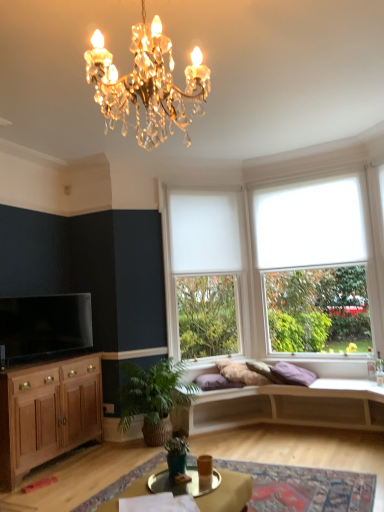
Locate an element on the screen. green leafy plant at lower center, positioned as the second houseplant in front-to-back order is located at coordinates (154, 398).

Locate an element on the screen. metallic silver cocktail table at center is located at coordinates (182, 484).

What is the approximate width of metallic silver cocktail table at center?

18.46 inches.

The height and width of the screenshot is (512, 384). I want to click on white roller blind at center, which appears as the first window when viewed from the left, so click(x=205, y=250).

Looking at this image, measure the distance between black glossy television at left and camera.

The distance of black glossy television at left from camera is 3.74 meters.

What is the approximate height of white roller blind at right, the 2th window when ordered from left to right?

white roller blind at right, the 2th window when ordered from left to right, is 2.23 meters in height.

What is the approximate height of white matte blind at upper center?

white matte blind at upper center is 3.46 feet in height.

What are the coordinates of `green leafy plant at lower center, the first houseplant when ordered from back to front` in the screenshot? It's located at (x=154, y=398).

Which of these two, white roller blind at center, the 2th window in the right-to-left sequence, or white matte studio couch at center, stands shorter?

white matte studio couch at center.

From the image's perspective, is white roller blind at center, the 2th window in the right-to-left sequence, below white matte studio couch at center?

No.

Considering the positions of objects white roller blind at center, which appears as the first window when viewed from the left, and white matte studio couch at center in the image provided, who is behind, white roller blind at center, which appears as the first window when viewed from the left, or white matte studio couch at center?

white roller blind at center, which appears as the first window when viewed from the left, is more distant.

Is white roller blind at center, the 2th window in the right-to-left sequence, facing towards white matte studio couch at center?

No, white roller blind at center, the 2th window in the right-to-left sequence, does not turn towards white matte studio couch at center.

Considering the positions of objects green leafy plant at lower center, positioned as the second houseplant in front-to-back order, and white roller blind at right, which appears as the 1th window when viewed from the right, in the image provided, who is in front, green leafy plant at lower center, positioned as the second houseplant in front-to-back order, or white roller blind at right, which appears as the 1th window when viewed from the right,?

green leafy plant at lower center, positioned as the second houseplant in front-to-back order, is more forward.

Is green leafy plant at lower center, positioned as the second houseplant in front-to-back order, at the right side of white roller blind at right, which appears as the 1th window when viewed from the right?

No, green leafy plant at lower center, positioned as the second houseplant in front-to-back order, is not to the right of white roller blind at right, which appears as the 1th window when viewed from the right.

I want to click on window that is the 2nd object to the right of the green leafy plant at lower center, positioned as the second houseplant in front-to-back order, starting at the anchor, so click(286, 267).

Measure the distance between green leafy plant at lower center, positioned as the second houseplant in front-to-back order, and white roller blind at right, which appears as the 1th window when viewed from the right.

A distance of 4.11 feet exists between green leafy plant at lower center, positioned as the second houseplant in front-to-back order, and white roller blind at right, which appears as the 1th window when viewed from the right.

From the image's perspective, is white roller blind at right beneath green matte plant at lower center, marked as the first houseplant in a front-to-back arrangement?

Actually, white roller blind at right appears above green matte plant at lower center, marked as the first houseplant in a front-to-back arrangement, in the image.

How far apart are white roller blind at right and green matte plant at lower center, marked as the first houseplant in a front-to-back arrangement?

white roller blind at right and green matte plant at lower center, marked as the first houseplant in a front-to-back arrangement, are 9.85 feet apart from each other.

Which of these two, white roller blind at right or green matte plant at lower center, acting as the second houseplant starting from the back, is smaller?

green matte plant at lower center, acting as the second houseplant starting from the back.

Is white roller blind at right aimed at green matte plant at lower center, marked as the first houseplant in a front-to-back arrangement?

No, white roller blind at right is not turned towards green matte plant at lower center, marked as the first houseplant in a front-to-back arrangement.

Is metallic gold tray at lower center smaller than white roller blind at center, the 2th window in the right-to-left sequence?

Yes, metallic gold tray at lower center is smaller than white roller blind at center, the 2th window in the right-to-left sequence.

What's the angular difference between metallic gold tray at lower center and white roller blind at center, the 2th window in the right-to-left sequence,'s facing directions?

43.5 degrees separate the facing orientations of metallic gold tray at lower center and white roller blind at center, the 2th window in the right-to-left sequence.

From the picture: From a real-world perspective, is metallic gold tray at lower center physically located above or below white roller blind at center, the 2th window in the right-to-left sequence?

metallic gold tray at lower center is situated lower than white roller blind at center, the 2th window in the right-to-left sequence, in the real world.

Considering the positions of objects metallic gold tray at lower center and white roller blind at center, which appears as the first window when viewed from the left, in the image provided, who is more to the right, metallic gold tray at lower center or white roller blind at center, which appears as the first window when viewed from the left,?

Positioned to the right is white roller blind at center, which appears as the first window when viewed from the left.

Looking at this image, from the image's perspective, is white roller blind at right, which appears as the 1th window when viewed from the right, above or below metallic gold tray at lower center?

white roller blind at right, which appears as the 1th window when viewed from the right, is above metallic gold tray at lower center.

From the picture: Considering the relative sizes of white roller blind at right, which appears as the 1th window when viewed from the right, and metallic gold tray at lower center in the image provided, is white roller blind at right, which appears as the 1th window when viewed from the right, wider than metallic gold tray at lower center?

No.

Considering the relative sizes of white roller blind at right, the 2th window when ordered from left to right, and metallic gold tray at lower center in the image provided, is white roller blind at right, the 2th window when ordered from left to right, smaller than metallic gold tray at lower center?

Incorrect, white roller blind at right, the 2th window when ordered from left to right, is not smaller in size than metallic gold tray at lower center.

Considering the relative positions of white roller blind at right, which appears as the 1th window when viewed from the right, and metallic gold tray at lower center in the image provided, is white roller blind at right, which appears as the 1th window when viewed from the right, to the left of metallic gold tray at lower center from the viewer's perspective?

In fact, white roller blind at right, which appears as the 1th window when viewed from the right, is to the right of metallic gold tray at lower center.

Is metallic gold tray at lower center spatially inside wooden cabinet at lower left, or outside of it?

Answer: metallic gold tray at lower center is outside wooden cabinet at lower left.

Looking at their sizes, would you say metallic gold tray at lower center is wider or thinner than wooden cabinet at lower left?

In the image, metallic gold tray at lower center appears to be wider than wooden cabinet at lower left.

From the image's perspective, which object appears higher, metallic gold tray at lower center or wooden cabinet at lower left?

From the image's view, wooden cabinet at lower left is above.

Considering the sizes of objects metallic gold tray at lower center and wooden cabinet at lower left in the image provided, who is bigger, metallic gold tray at lower center or wooden cabinet at lower left?

wooden cabinet at lower left is bigger.

Is purple cotton pillow at center wider than white roller blind at center, which appears as the first window when viewed from the left?

Indeed, purple cotton pillow at center has a greater width compared to white roller blind at center, which appears as the first window when viewed from the left.

From the image's perspective, who appears lower, purple cotton pillow at center or white roller blind at center, the 2th window in the right-to-left sequence?

From the image's view, purple cotton pillow at center is below.

Is point (237, 371) closer to camera compared to point (166, 222)?

That is True.

Considering the relative positions of purple cotton pillow at center and white roller blind at center, the 2th window in the right-to-left sequence, in the image provided, is purple cotton pillow at center to the left of white roller blind at center, the 2th window in the right-to-left sequence, from the viewer's perspective?

No, purple cotton pillow at center is not to the left of white roller blind at center, the 2th window in the right-to-left sequence.

The height and width of the screenshot is (512, 384). I want to click on studio couch in front of the white roller blind at center, the 2th window in the right-to-left sequence, so click(x=287, y=406).

From a real-world perspective, starting from the white roller blind at right, the 2th window when ordered from left to right, which houseplant is the 2nd one below it? Please provide its 2D coordinates.

[(154, 398)]

Looking at the image, which one is located further to white roller blind at right, black glossy television at left or white matte blind at upper center?

Based on the image, black glossy television at left appears to be further to white roller blind at right.

Considering their positions, is white roller blind at right positioned further to green leafy plant at lower center, the first houseplant when ordered from back to front, than white roller blind at center, the 2th window in the right-to-left sequence?

white roller blind at right is positioned further to the anchor green leafy plant at lower center, the first houseplant when ordered from back to front.

Estimate the real-world distances between objects in this image. Which object is closer to purple cotton pillow at center, white matte blind at upper center or wooden cabinet at lower left?

white matte blind at upper center is positioned closer to the anchor purple cotton pillow at center.

Which object lies further to the anchor point white roller blind at right, which appears as the 1th window when viewed from the right, metallic silver cocktail table at center or black glossy television at left?

metallic silver cocktail table at center lies further to white roller blind at right, which appears as the 1th window when viewed from the right, than the other object.

Based on their spatial positions, is green leafy plant at lower center, positioned as the second houseplant in front-to-back order, or metallic gold tray at lower center further from black glossy television at left?

Based on the image, metallic gold tray at lower center appears to be further to black glossy television at left.

Based on their spatial positions, is white matte blind at upper center or green leafy plant at lower center, the first houseplant when ordered from back to front, closer to white roller blind at right?

white matte blind at upper center lies closer to white roller blind at right than the other object.

When comparing their distances from white roller blind at center, which appears as the first window when viewed from the left, does metallic gold tray at lower center or wooden cabinet at lower left seem closer?

The object closer to white roller blind at center, which appears as the first window when viewed from the left, is wooden cabinet at lower left.

Estimate the real-world distances between objects in this image. Which object is further from green leafy plant at lower center, the first houseplant when ordered from back to front, wooden cabinet at lower left or white matte studio couch at center?

Based on the image, wooden cabinet at lower left appears to be further to green leafy plant at lower center, the first houseplant when ordered from back to front.

You are a GUI agent. You are given a task and a screenshot of the screen. Output one action in this format:
    pyautogui.click(x=<x>, y=<y>)
    Task: Click on the houseplant between metallic gold tray at lower center and white matte studio couch at center from front to back
    
    Given the screenshot: What is the action you would take?
    pyautogui.click(x=177, y=455)

Image resolution: width=384 pixels, height=512 pixels. In order to click on pillow between metallic gold tray at lower center and white roller blind at right in the front-back direction in this screenshot , I will do `click(241, 373)`.

Identify the location of pillow between white roller blind at right and white matte studio couch at center from top to bottom. Image resolution: width=384 pixels, height=512 pixels. [241, 373].

I want to click on studio couch between metallic silver cocktail table at center and white matte blind at upper center along the z-axis, so click(287, 406).